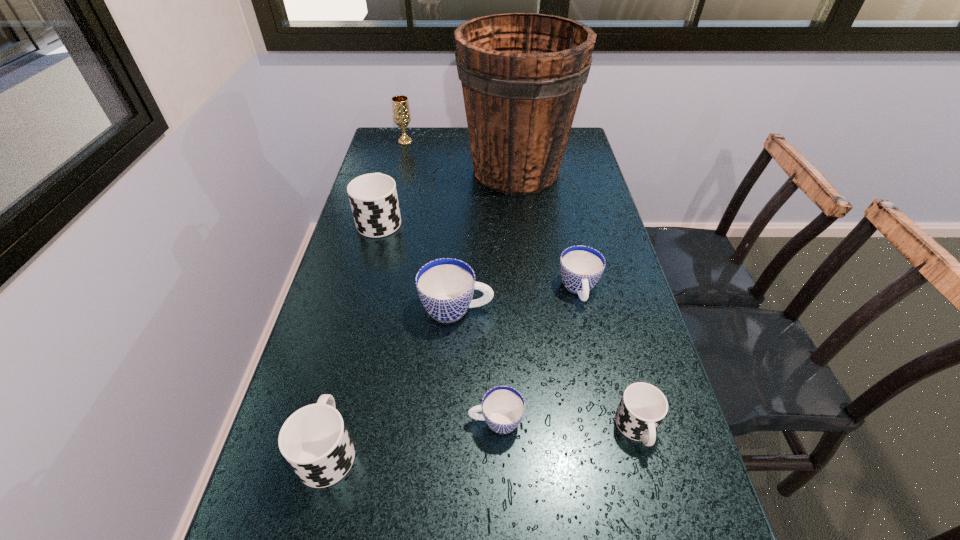
Locate an element on the screen. free space located 0.080m on the side of the rightmost black cup with the handle is located at coordinates (657, 501).

You are a GUI agent. You are given a task and a screenshot of the screen. Output one action in this format:
    pyautogui.click(x=<x>, y=<y>)
    Task: Click on the blank area located 0.070m on the side of the shortest cup with the handle
    This screenshot has width=960, height=540.
    Given the screenshot: What is the action you would take?
    pyautogui.click(x=433, y=421)

The width and height of the screenshot is (960, 540). I want to click on free space located on the side of the shortest cup with the handle, so click(x=287, y=421).

Locate an element on the screen. vacant area situated 0.090m on the side of the shortest cup with the handle is located at coordinates (423, 421).

Identify the location of bucket that is at the far edge. The width and height of the screenshot is (960, 540). (522, 74).

This screenshot has width=960, height=540. In order to click on chalice that is positioned at the far edge in this screenshot , I will do `click(400, 105)`.

The image size is (960, 540). Identify the location of chalice located at the left edge. (400, 105).

Locate an element on the screen. Image resolution: width=960 pixels, height=540 pixels. bucket at the right edge is located at coordinates (522, 74).

At what (x,y) coordinates should I click in order to perform the action: click on object present at the far left corner. Please return your answer as a coordinate pair (x, y). The height and width of the screenshot is (540, 960). Looking at the image, I should click on (400, 105).

Image resolution: width=960 pixels, height=540 pixels. I want to click on object at the far right corner, so click(522, 74).